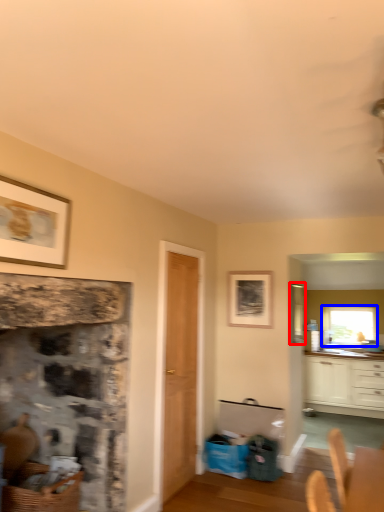
Question: Which point is further to the camera, window screen (highlighted by a red box) or window (highlighted by a blue box)?

Choices:
 (A) window screen
 (B) window

Answer: (B)